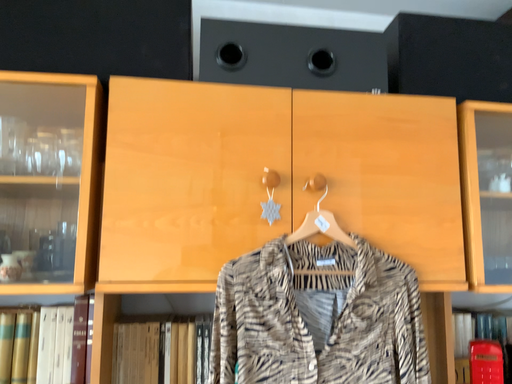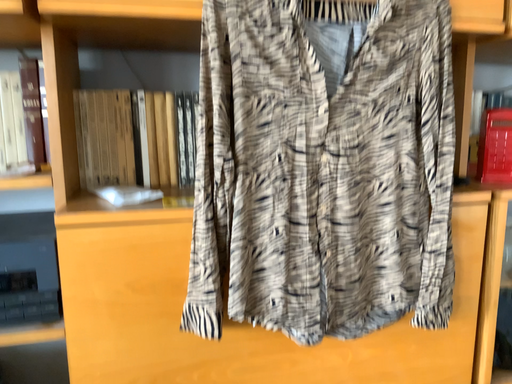
Question: How did the camera likely rotate when shooting the video?

Choices:
 (A) rotated downward
 (B) rotated upward

Answer: (A)